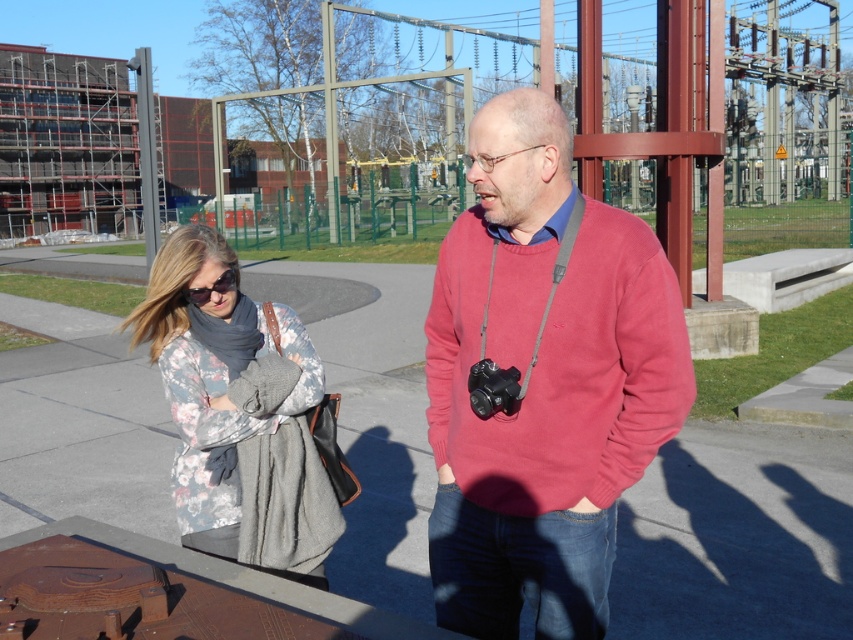
How far apart are matte red sweater at center and floral-patterned fabric at center?

matte red sweater at center and floral-patterned fabric at center are 84.82 centimeters apart.

Is matte red sweater at center closer to the viewer compared to floral-patterned fabric at center?

Yes.

Does point (473, 211) come in front of point (252, 401)?

Yes, point (473, 211) is closer to viewer.

Identify the location of matte red sweater at center. (543, 381).

How much distance is there between matte red sweater at center and matte pink sweater at center?

0.77 inches

Describe the element at coordinates (543, 381) in the screenshot. The height and width of the screenshot is (640, 853). I see `matte red sweater at center` at that location.

Which is in front, point (561, 387) or point (564, 456)?

Point (561, 387) is in front.

The image size is (853, 640). I want to click on matte red sweater at center, so click(543, 381).

Between matte pink sweater at center and matte black sunglasses at center, which one is positioned higher?

Positioned higher is matte black sunglasses at center.

Does matte pink sweater at center have a larger size compared to matte black sunglasses at center?

Yes.

Between point (552, 588) and point (206, 300), which one is positioned behind?

The point (206, 300) is behind.

Locate an element on the screen. matte pink sweater at center is located at coordinates (543, 384).